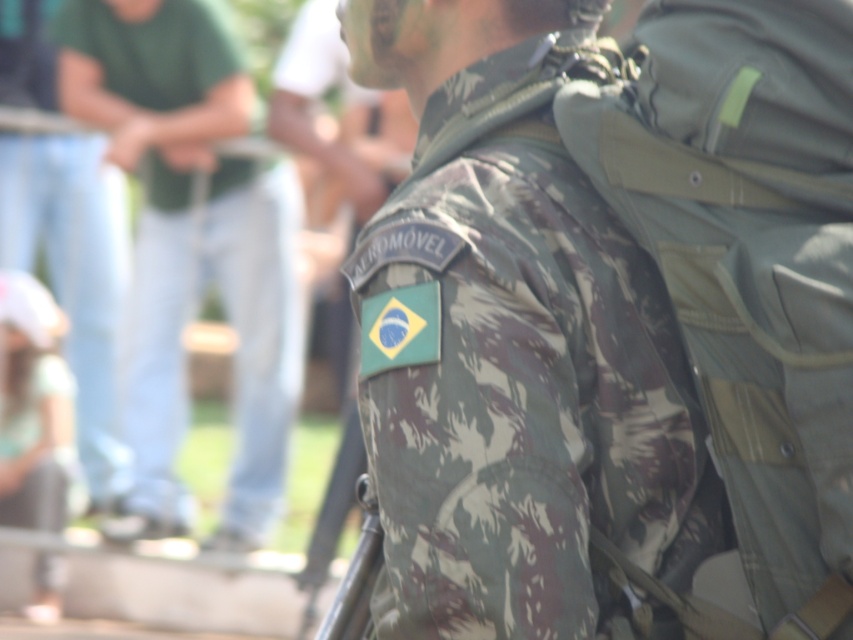
You are a photographer trying to capture a clear image of the two points on the backpack of the Brazilian military member. Which point, point (519,464) or point (199,74), is easier to focus on?

Point (519,464) is closer to the camera than point (199,74), so it is easier to focus on.